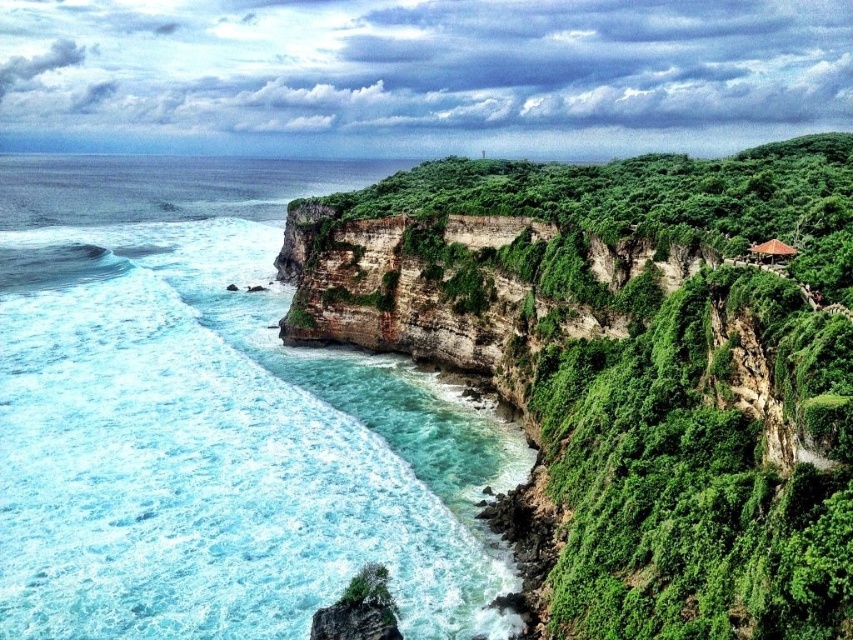
Question: Which of the following is the farthest from the observer?

Choices:
 (A) clear blue water at left
 (B) brown thatched hut at upper right
 (C) green leafy vegetation at center

Answer: (B)

Question: Which of the following is the closest to the observer?

Choices:
 (A) green leafy vegetation at center
 (B) brown thatched hut at upper right
 (C) clear blue water at left

Answer: (A)

Question: Can you confirm if green leafy vegetation at center is positioned to the left of clear blue water at left?

Choices:
 (A) yes
 (B) no

Answer: (B)

Question: Can you confirm if clear blue water at left is positioned to the right of brown thatched hut at upper right?

Choices:
 (A) yes
 (B) no

Answer: (B)

Question: From the image, what is the correct spatial relationship of green leafy vegetation at center in relation to clear blue water at left?

Choices:
 (A) left
 (B) right

Answer: (B)

Question: Which point appears farthest from the camera in this image?

Choices:
 (A) (302, 477)
 (B) (769, 260)

Answer: (A)